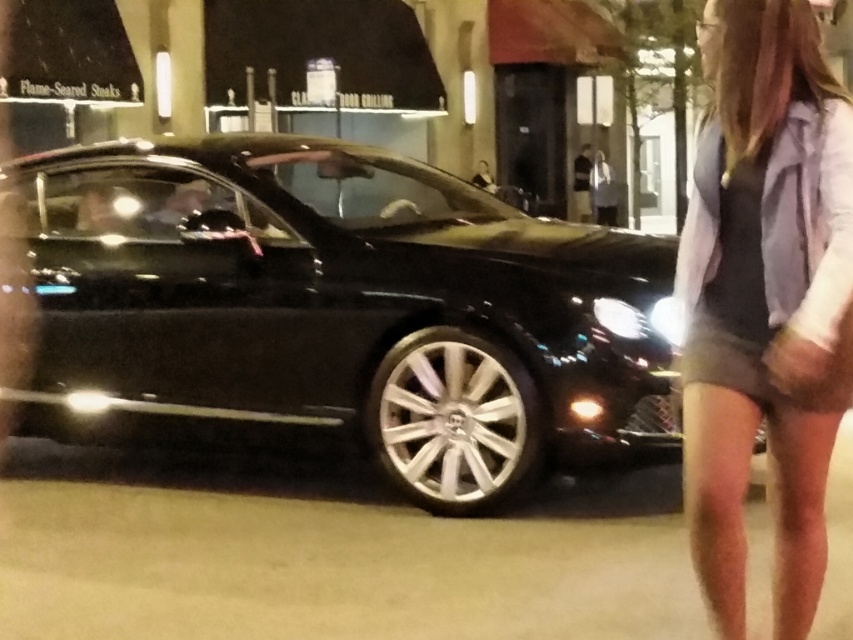
You are a security camera monitoring the area. You notice the shiny black car at center and the gray fabric shorts at lower right. Based on their positions, which object is closer to the left edge of the frame?

The shiny black car at center is positioned on the left side of gray fabric shorts at lower right, so it is closer to the left edge of the frame.

You are standing in the middle of the street and see the shiny black car at center and the gray fabric shorts at lower right. Which object is closer to you?

The shiny black car at center is closer to you because it is further to the viewer than the gray fabric shorts at lower right.